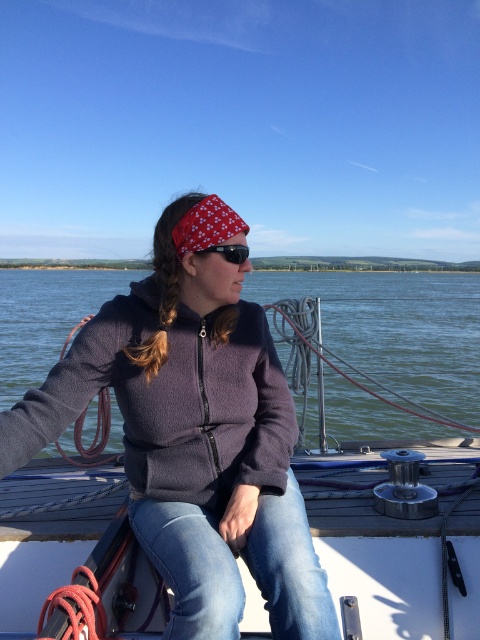
Measure the distance between dark gray fleece jacket at center and black matte sunglasses at center.

A distance of 24.82 inches exists between dark gray fleece jacket at center and black matte sunglasses at center.

Is point (302, 609) closer to camera compared to point (229, 244)?

Yes, point (302, 609) is closer to viewer.

The image size is (480, 640). What do you see at coordinates (194, 440) in the screenshot?
I see `dark gray fleece jacket at center` at bounding box center [194, 440].

Where is `dark gray fleece jacket at center`? dark gray fleece jacket at center is located at coordinates [x=194, y=440].

Where is `dark gray fleece jacket at center`? The width and height of the screenshot is (480, 640). dark gray fleece jacket at center is located at coordinates (194, 440).

Can you confirm if dark gray fleece jacket at center is shorter than red dotted bandana at center?

Answer: No.

Find the location of a particular element. The height and width of the screenshot is (640, 480). dark gray fleece jacket at center is located at coordinates (194, 440).

Between red dotted bandana at center and black matte sunglasses at center, which one is positioned higher?

red dotted bandana at center is above.

Can you confirm if red dotted bandana at center is shorter than black matte sunglasses at center?

No, red dotted bandana at center is not shorter than black matte sunglasses at center.

Is point (243, 232) behind point (210, 248)?

That is True.

You are a GUI agent. You are given a task and a screenshot of the screen. Output one action in this format:
    pyautogui.click(x=<x>, y=<y>)
    Task: Click on the red dotted bandana at center
    The height and width of the screenshot is (640, 480).
    Given the screenshot: What is the action you would take?
    pyautogui.click(x=205, y=225)